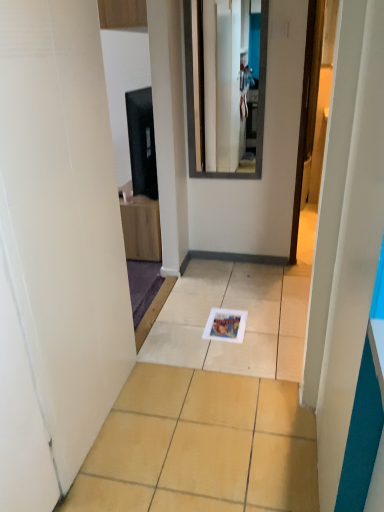
Question: Is matte black tv at upper left positioned far away from smooth glass mirror at upper center?

Choices:
 (A) no
 (B) yes

Answer: (A)

Question: Would you say matte black tv at upper left is outside smooth glass mirror at upper center?

Choices:
 (A) no
 (B) yes

Answer: (B)

Question: Is matte black tv at upper left shorter than smooth glass mirror at upper center?

Choices:
 (A) no
 (B) yes

Answer: (B)

Question: Can you confirm if matte black tv at upper left is smaller than smooth glass mirror at upper center?

Choices:
 (A) no
 (B) yes

Answer: (A)

Question: Does matte black tv at upper left turn towards smooth glass mirror at upper center?

Choices:
 (A) yes
 (B) no

Answer: (B)

Question: From the image's perspective, would you say matte black tv at upper left is shown under smooth glass mirror at upper center?

Choices:
 (A) no
 (B) yes

Answer: (B)

Question: From the image's perspective, is matte black tv at upper left below white glossy tile at center?

Choices:
 (A) no
 (B) yes

Answer: (A)

Question: Is matte black tv at upper left oriented towards white glossy tile at center?

Choices:
 (A) yes
 (B) no

Answer: (B)

Question: Does matte black tv at upper left have a lesser height compared to white glossy tile at center?

Choices:
 (A) yes
 (B) no

Answer: (B)

Question: Considering the relative positions of matte black tv at upper left and white glossy tile at center in the image provided, is matte black tv at upper left behind white glossy tile at center?

Choices:
 (A) no
 (B) yes

Answer: (B)

Question: From the image's perspective, is matte black tv at upper left on top of white glossy tile at center?

Choices:
 (A) no
 (B) yes

Answer: (B)

Question: Is matte black tv at upper left closer to camera compared to white glossy tile at center?

Choices:
 (A) yes
 (B) no

Answer: (B)

Question: Would you say matte black tv at upper left is part of smooth glass mirror at upper center's contents?

Choices:
 (A) no
 (B) yes

Answer: (A)